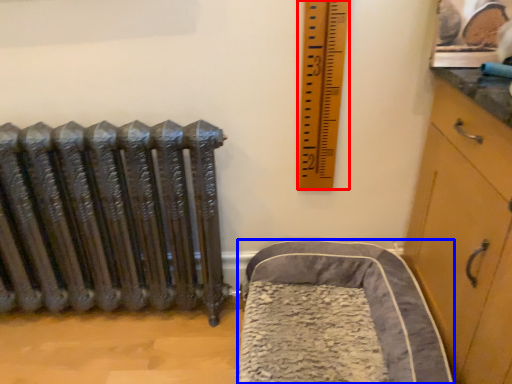
Question: Which point is closer to the camera, ruler (highlighted by a red box) or furniture (highlighted by a blue box)?

Choices:
 (A) ruler
 (B) furniture

Answer: (B)